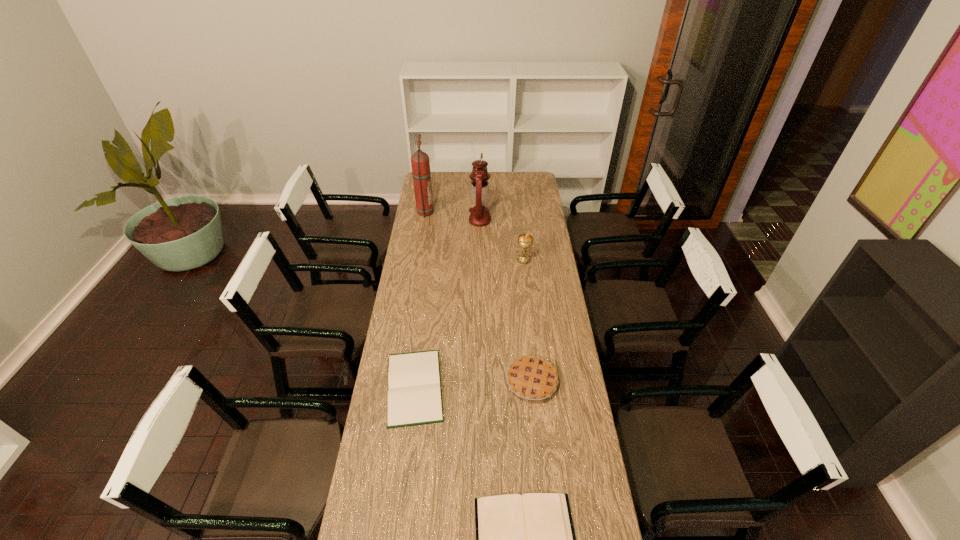
Locate an element on the screen. free spot that satisfies the following two spatial constraints: 1. on the side of the fire extinguisher with the label and nozzle; 2. on the right side of the left hardback book is located at coordinates pyautogui.click(x=395, y=387).

At what (x,y) coordinates should I click in order to perform the action: click on vacant space that satisfies the following two spatial constraints: 1. on the back side of the third tallest object; 2. on the right side of the pie. Please return your answer as a coordinate pair (x, y). This screenshot has height=540, width=960. Looking at the image, I should click on (519, 260).

Locate an element on the screen. The height and width of the screenshot is (540, 960). free space in the image that satisfies the following two spatial constraints: 1. on the back side of the fourth nearest object; 2. on the right side of the farther hardback book is located at coordinates (430, 260).

Locate an element on the screen. vacant region that satisfies the following two spatial constraints: 1. on the side of the fire extinguisher with the label and nozzle; 2. on the right side of the pie is located at coordinates (396, 381).